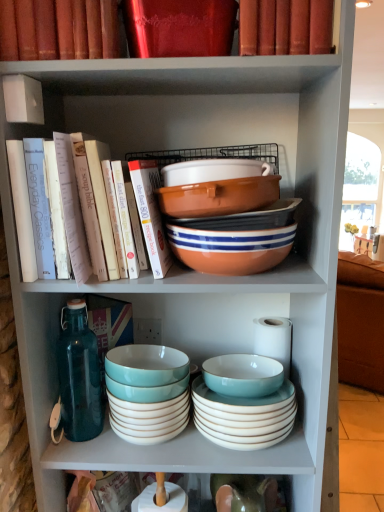
Image resolution: width=384 pixels, height=512 pixels. Find the location of `vacant area on top of matte ceramic bowl at lower center, the 2th bowl from the bottom (from a real-world perspective)`. vacant area on top of matte ceramic bowl at lower center, the 2th bowl from the bottom (from a real-world perspective) is located at coordinates (249, 385).